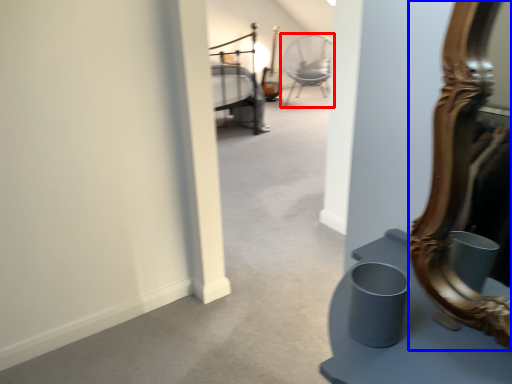
Question: Which of the following is the closest to the observer, chair (highlighted by a red box) or mirror (highlighted by a blue box)?

Choices:
 (A) chair
 (B) mirror

Answer: (B)